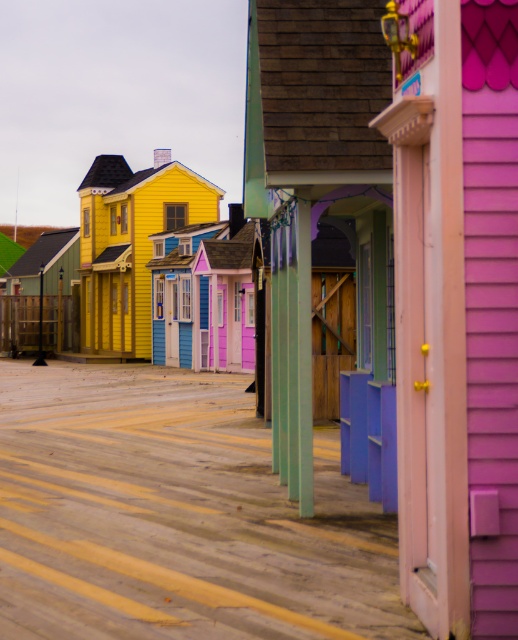
Question: Which point is closer to the camera?

Choices:
 (A) matte yellow house at center
 (B) pink matte door at center

Answer: (B)

Question: Estimate the real-world distances between objects in this image. Which object is closer to the green matte hut at center?

Choices:
 (A) wooden fence at left
 (B) purple wood porch at center
 (C) pink matte door at center

Answer: (A)

Question: Can you confirm if pink matte door at center is wider than green matte hut at center?

Choices:
 (A) yes
 (B) no

Answer: (B)

Question: Which object is farther from the camera taking this photo?

Choices:
 (A) pink matte door at center
 (B) wooden fence at left

Answer: (B)

Question: Is pink matte door at center to the left of purple wood porch at center from the viewer's perspective?

Choices:
 (A) yes
 (B) no

Answer: (B)

Question: Is pink matte door at center closer to camera compared to green matte hut at center?

Choices:
 (A) no
 (B) yes

Answer: (B)